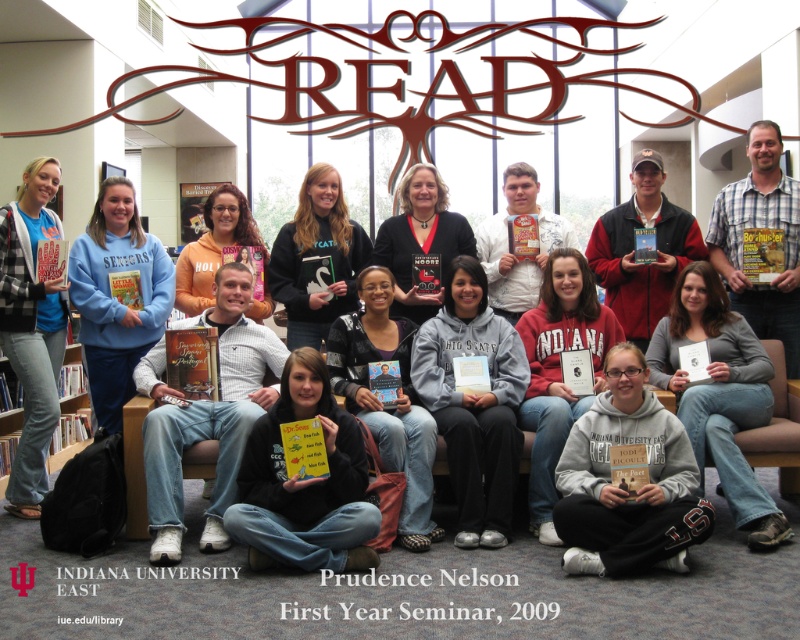
You are a photographer trying to capture a clear photo of the white striped shirt at center and the black matte sweatshirt at center. Since you want both to be visible, which one should you focus on first to ensure the background is sharp?

The white striped shirt at center is much taller as black matte sweatshirt at center, so you should focus on the white striped shirt at center first to ensure the background remains sharp.